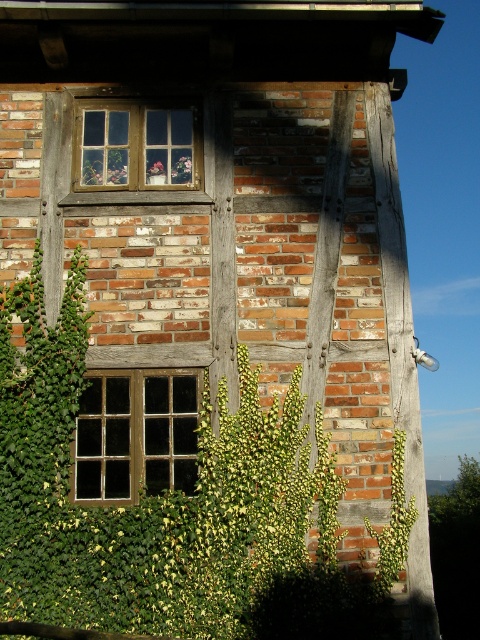
Question: Which point is farther from the camera taking this photo?

Choices:
 (A) (402, 518)
 (B) (100, 180)

Answer: (B)

Question: Which point is farther to the camera?

Choices:
 (A) (191, 112)
 (B) (182, 417)

Answer: (A)

Question: Is wooden window at lower left thinner than wooden frame at center?

Choices:
 (A) yes
 (B) no

Answer: (A)

Question: Is wooden frame at center smaller than green leafy plant at right?

Choices:
 (A) no
 (B) yes

Answer: (A)

Question: Which of the following is the farthest from the observer?

Choices:
 (A) wooden frame at center
 (B) wooden window at lower left

Answer: (A)

Question: In this image, where is wooden window at lower left located relative to green leafy plant at right?

Choices:
 (A) above
 (B) below

Answer: (A)